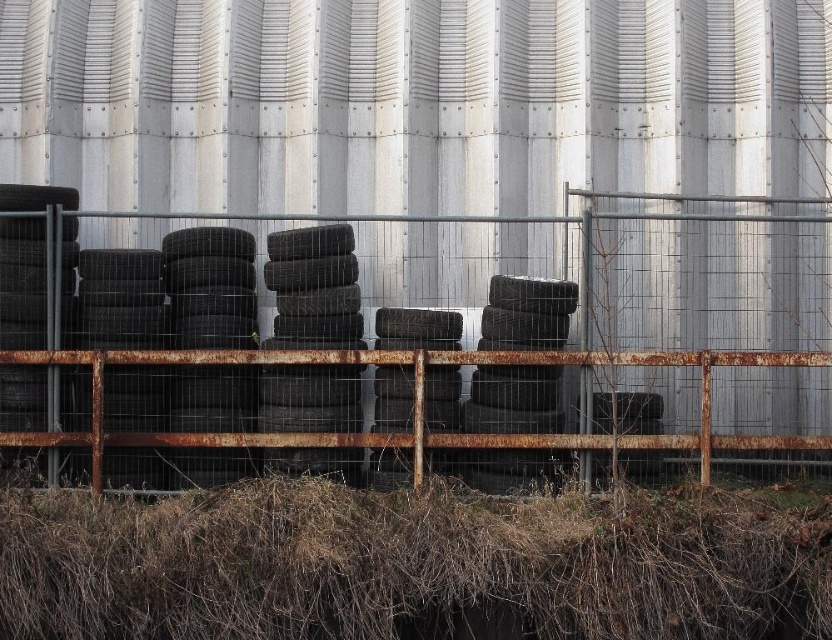
Question: Is rusty metal fence at center to the right of brown dry hay at bottom from the viewer's perspective?

Choices:
 (A) no
 (B) yes

Answer: (B)

Question: Which point is closer to the camera?

Choices:
 (A) rusty metal fence at center
 (B) brown dry hay at bottom

Answer: (B)

Question: Is rusty metal fence at center further to the viewer compared to brown dry hay at bottom?

Choices:
 (A) no
 (B) yes

Answer: (B)

Question: Is rusty metal fence at center positioned behind brown dry hay at bottom?

Choices:
 (A) no
 (B) yes

Answer: (B)

Question: Among these points, which one is nearest to the camera?

Choices:
 (A) (674, 493)
 (B) (533, 369)

Answer: (A)